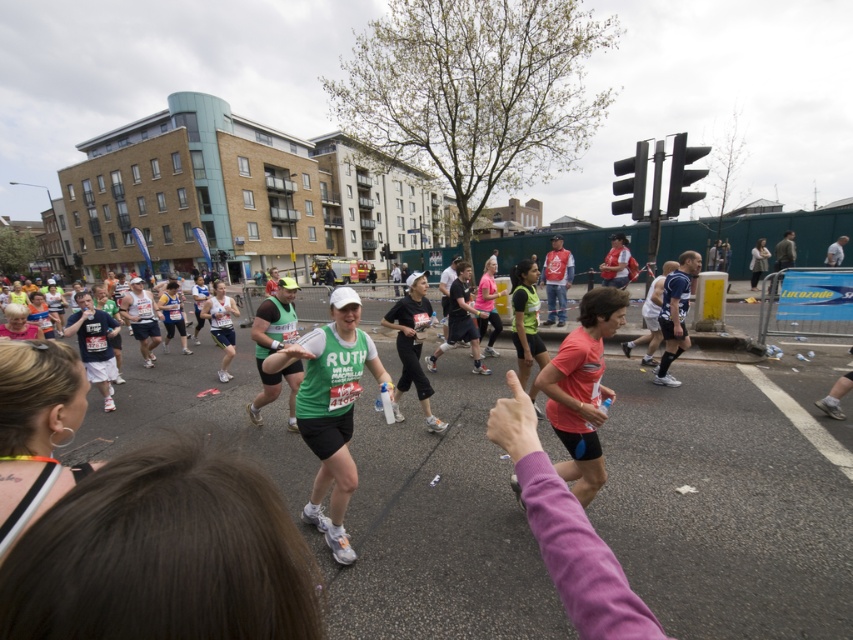
You are a photographer at the marathon event. You want to capture a photo that includes both the neon yellow hair at center and the matte pink shirt at center. Based on their positions, which one should you focus on first to ensure both are in the frame?

The neon yellow hair at center is located above the matte pink shirt at center, so you should focus on the matte pink shirt at center first to ensure both are in the frame.